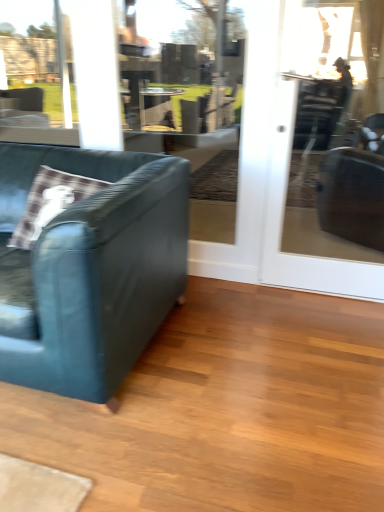
Where is `vacant area that is in front of transparent glass screen door at center`? This screenshot has height=512, width=384. vacant area that is in front of transparent glass screen door at center is located at coordinates (333, 325).